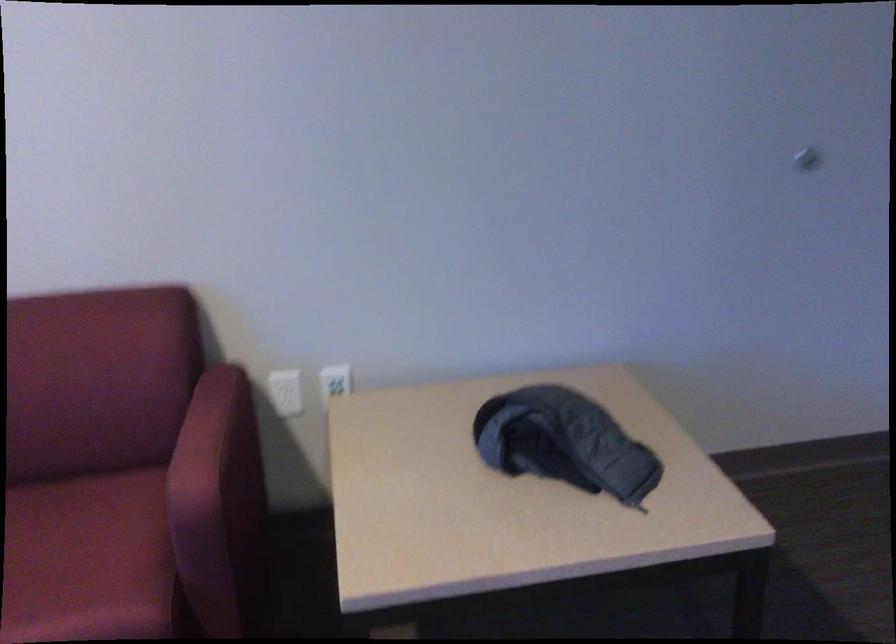
The width and height of the screenshot is (896, 644). What do you see at coordinates (88, 560) in the screenshot? I see `a chair sitting surface` at bounding box center [88, 560].